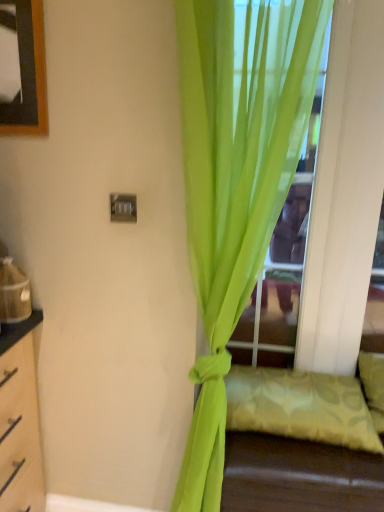
Locate an element on the screen. The width and height of the screenshot is (384, 512). lime green sheer curtain at center is located at coordinates (235, 188).

Is light green fabric pillow at lower right wider or thinner than transparent glass door at center?

In the image, light green fabric pillow at lower right appears to be wider than transparent glass door at center.

Considering the positions of point (336, 426) and point (268, 65), is point (336, 426) closer or farther from the camera than point (268, 65)?

Clearly, point (336, 426) is more distant from the camera than point (268, 65).

Would you say light green fabric pillow at lower right contains transparent glass door at center?

No, light green fabric pillow at lower right does not contain transparent glass door at center.

Considering the positions of objects lime green sheer curtain at center and light green fabric pillow at lower right in the image provided, who is behind, lime green sheer curtain at center or light green fabric pillow at lower right?

light green fabric pillow at lower right is further from the camera.

Which of these two, lime green sheer curtain at center or light green fabric pillow at lower right, stands taller?

Standing taller between the two is lime green sheer curtain at center.

From a real-world perspective, which object rests below the other?

light green fabric pillow at lower right.

Are lime green sheer curtain at center and light green fabric pillow at lower right making contact?

No, lime green sheer curtain at center is not in contact with light green fabric pillow at lower right.

From a real-world perspective, which object rests below the other?

light green fabric pillow at lower right, from a real-world perspective.

Is transparent glass door at center wider or thinner than light green fabric pillow at lower right?

In the image, transparent glass door at center appears to be more narrow than light green fabric pillow at lower right.

Based on the photo, is transparent glass door at center positioned with its back to light green fabric pillow at lower right?

No, transparent glass door at center is not facing away from light green fabric pillow at lower right.

Is point (309, 134) behind point (274, 426)?

No, (309, 134) is in front of (274, 426).

From a real-world perspective, relative to lime green sheer curtain at center, is light green fabric pillow at lower right vertically above or below?

From a real-world perspective, light green fabric pillow at lower right is physically below lime green sheer curtain at center.

Does light green fabric pillow at lower right lie behind lime green sheer curtain at center?

Yes.

Which object is thinner, light green fabric pillow at lower right or lime green sheer curtain at center?

With smaller width is lime green sheer curtain at center.

From the image's perspective, does light green fabric pillow at lower right appear lower than lime green sheer curtain at center?

Yes, from the image's perspective, light green fabric pillow at lower right is below lime green sheer curtain at center.

Between transparent glass door at center and lime green sheer curtain at center, which one has less height?

transparent glass door at center is shorter.

Can you confirm if transparent glass door at center is positioned to the left of lime green sheer curtain at center?

No.

Is transparent glass door at center positioned in front of lime green sheer curtain at center?

No, the depth of transparent glass door at center is greater than that of lime green sheer curtain at center.

Considering the relative sizes of transparent glass door at center and lime green sheer curtain at center in the image provided, is transparent glass door at center thinner than lime green sheer curtain at center?

Yes.

How different are the orientations of lime green sheer curtain at center and transparent glass door at center in degrees?

There is a 4.45-degree angle between the facing directions of lime green sheer curtain at center and transparent glass door at center.

Considering the sizes of objects lime green sheer curtain at center and transparent glass door at center in the image provided, who is taller, lime green sheer curtain at center or transparent glass door at center?

Standing taller between the two is lime green sheer curtain at center.

Is lime green sheer curtain at center facing towards transparent glass door at center?

Yes, lime green sheer curtain at center is turned towards transparent glass door at center.

Where is `glass door above the light green fabric pillow at lower right (from a real-world perspective)`? The image size is (384, 512). glass door above the light green fabric pillow at lower right (from a real-world perspective) is located at coordinates (278, 51).

At what (x,y) coordinates should I click in order to perform the action: click on curtain above the light green fabric pillow at lower right (from the image's perspective). Please return your answer as a coordinate pair (x, y). This screenshot has width=384, height=512. Looking at the image, I should click on (235, 188).

Which object lies further to the anchor point lime green sheer curtain at center, transparent glass door at center or light green fabric pillow at lower right?

light green fabric pillow at lower right is further to lime green sheer curtain at center.

Which object lies nearer to the anchor point light green fabric pillow at lower right, lime green sheer curtain at center or transparent glass door at center?

Based on the image, lime green sheer curtain at center appears to be nearer to light green fabric pillow at lower right.

Which object lies nearer to the anchor point transparent glass door at center, light green fabric pillow at lower right or lime green sheer curtain at center?

lime green sheer curtain at center is positioned closer to the anchor transparent glass door at center.

Which object lies nearer to the anchor point lime green sheer curtain at center, light green fabric pillow at lower right or transparent glass door at center?

The object closer to lime green sheer curtain at center is transparent glass door at center.

Estimate the real-world distances between objects in this image. Which object is closer to transparent glass door at center, lime green sheer curtain at center or light green fabric pillow at lower right?

Among the two, lime green sheer curtain at center is located nearer to transparent glass door at center.

Which object lies nearer to the anchor point light green fabric pillow at lower right, transparent glass door at center or lime green sheer curtain at center?

The object closer to light green fabric pillow at lower right is lime green sheer curtain at center.

Where is `curtain between transparent glass door at center and light green fabric pillow at lower right vertically`? The image size is (384, 512). curtain between transparent glass door at center and light green fabric pillow at lower right vertically is located at coordinates (235, 188).